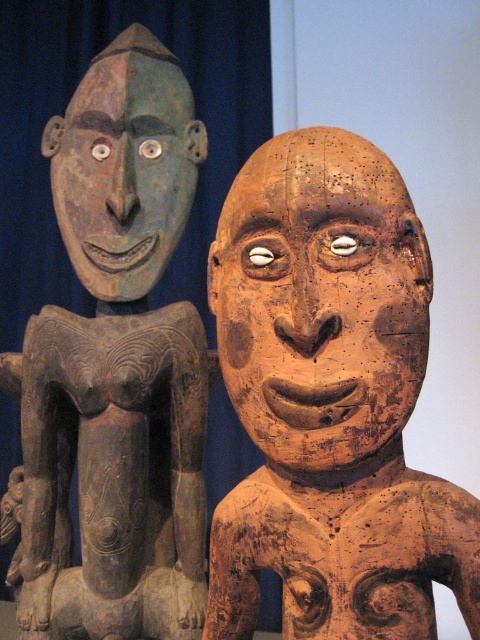
Does matte gray wood figure at left appear on the right side of brown wooden mask at center?

Incorrect, matte gray wood figure at left is not on the right side of brown wooden mask at center.

Is matte gray wood figure at left further to the viewer compared to brown wooden mask at center?

Yes.

Is point (120, 42) less distant than point (432, 282)?

No, (120, 42) is behind (432, 282).

Find the location of a particular element. matte gray wood figure at left is located at coordinates (115, 371).

Which is more to the left, brown wooden mask at center or matte green wood mask at upper left?

matte green wood mask at upper left

Can you confirm if brown wooden mask at center is positioned above matte green wood mask at upper left?

No, brown wooden mask at center is not above matte green wood mask at upper left.

Who is more distant from viewer, (319, 173) or (51, 182)?

Positioned behind is point (51, 182).

You are a GUI agent. You are given a task and a screenshot of the screen. Output one action in this format:
    pyautogui.click(x=<x>, y=<y>)
    Task: Click on the brown wooden mask at center
    Image resolution: width=480 pixels, height=640 pixels.
    Given the screenshot: What is the action you would take?
    pyautogui.click(x=321, y=300)

Measure the distance from matte gray wood figure at left to matte green wood mask at upper left.

matte gray wood figure at left and matte green wood mask at upper left are 3.45 inches apart.

Is matte gray wood figure at left thinner than matte green wood mask at upper left?

No, matte gray wood figure at left is not thinner than matte green wood mask at upper left.

What do you see at coordinates (115, 371) in the screenshot? I see `matte gray wood figure at left` at bounding box center [115, 371].

The width and height of the screenshot is (480, 640). What are the coordinates of `matte gray wood figure at left` in the screenshot? It's located at (115, 371).